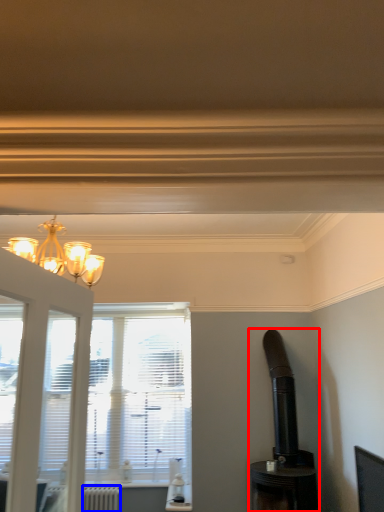
Question: Among these objects, which one is farthest to the camera, appliance (highlighted by a red box) or radiator (highlighted by a blue box)?

Choices:
 (A) appliance
 (B) radiator

Answer: (B)